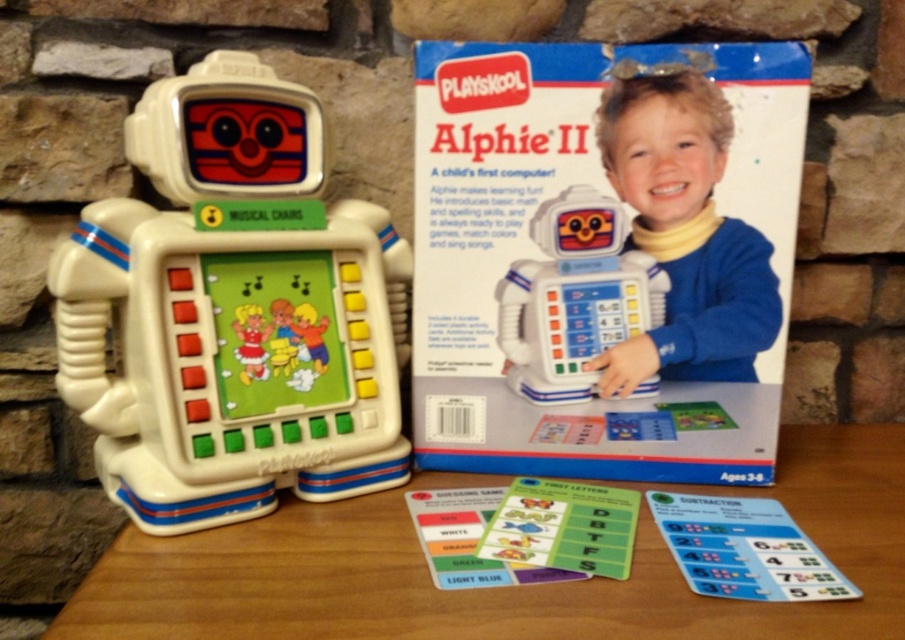
Question: Estimate the real-world distances between objects in this image. Which object is closer to the wooden table at lower center?

Choices:
 (A) cardboard cards at lower center
 (B) white plastic robot at left

Answer: (A)

Question: Which point is closer to the camera taking this photo?

Choices:
 (A) (808, 502)
 (B) (626, 508)

Answer: (B)

Question: Which of the following is the farthest from the observer?

Choices:
 (A) (697, 561)
 (B) (326, 456)
 (C) (680, 209)
 (D) (545, 321)

Answer: (D)

Question: Is white plastic robot at left below wooden table at lower center?

Choices:
 (A) yes
 (B) no

Answer: (B)

Question: From the image, what is the correct spatial relationship of yellow turtleneck sweater at upper center in relation to white plastic robot at center?

Choices:
 (A) right
 (B) left

Answer: (A)

Question: Is white plastic robot at left to the right of white plastic robot at center from the viewer's perspective?

Choices:
 (A) yes
 (B) no

Answer: (B)